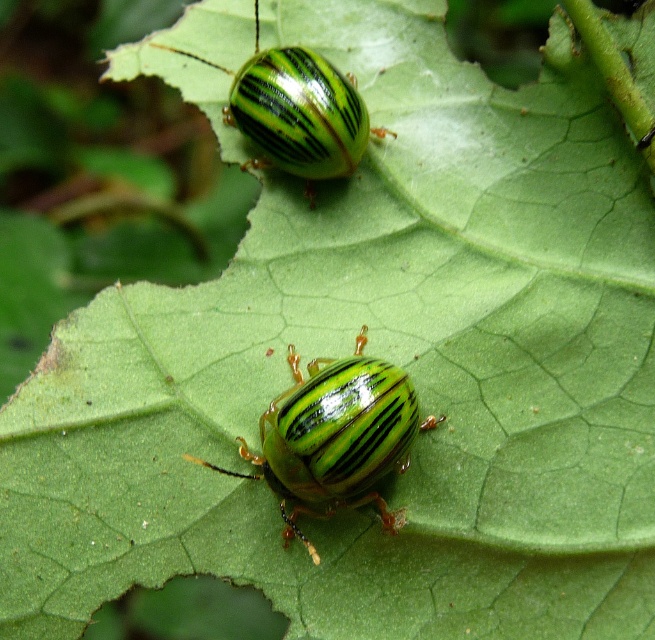
Question: Is green glossy beetle at center wider than green glossy beetle at upper center?

Choices:
 (A) yes
 (B) no

Answer: (B)

Question: Which point is farther to the camera?

Choices:
 (A) green glossy beetle at upper center
 (B) green glossy beetle at center

Answer: (A)

Question: Does green glossy beetle at center appear on the left side of green glossy beetle at upper center?

Choices:
 (A) no
 (B) yes

Answer: (A)

Question: Which object appears farthest from the camera in this image?

Choices:
 (A) green glossy beetle at upper center
 (B) green glossy beetle at center

Answer: (A)

Question: Which point is closer to the camera?

Choices:
 (A) tap(316, 97)
 (B) tap(398, 445)

Answer: (B)

Question: Is green glossy beetle at center positioned behind green glossy beetle at upper center?

Choices:
 (A) no
 (B) yes

Answer: (A)